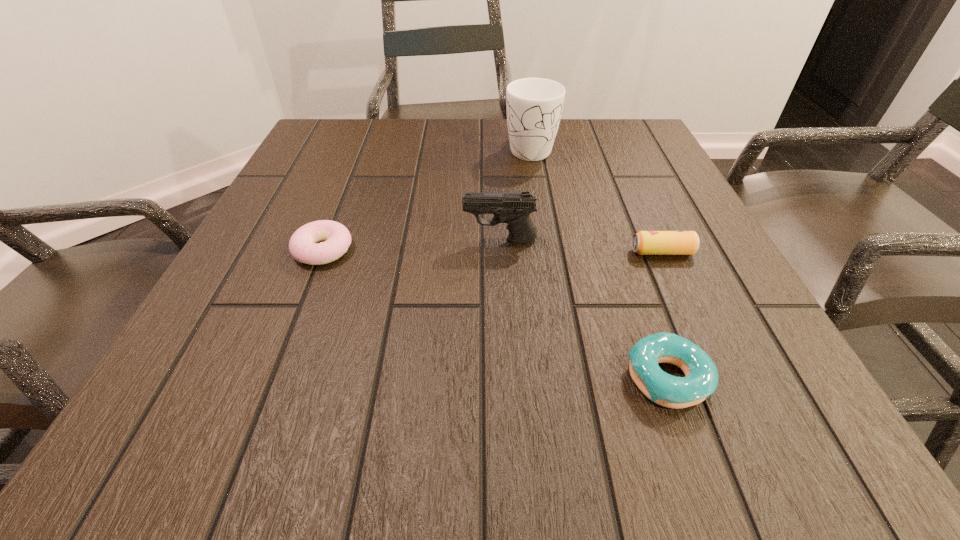
At what (x,y) coordinates should I click in order to perform the action: click on the tallest object. Please return your answer as a coordinate pair (x, y). Image resolution: width=960 pixels, height=540 pixels. Looking at the image, I should click on pos(534,106).

This screenshot has height=540, width=960. What are the coordinates of `mug` in the screenshot? It's located at (534, 106).

The height and width of the screenshot is (540, 960). I want to click on pistol, so click(514, 209).

Identify the location of beer can. (644, 242).

At what (x,y) coordinates should I click in order to perform the action: click on the nearer doughnut. Please return your answer as a coordinate pair (x, y). This screenshot has height=540, width=960. Looking at the image, I should click on (701, 380).

Locate an element on the screen. The height and width of the screenshot is (540, 960). the right doughnut is located at coordinates (701, 380).

This screenshot has width=960, height=540. What are the coordinates of `the leftmost object` in the screenshot? It's located at (337, 239).

Identify the location of the farther doughnut. The image size is (960, 540). 337,239.

This screenshot has width=960, height=540. What are the coordinates of `vacant point located on the side of the farthest object with the handle` in the screenshot? It's located at (536, 182).

I want to click on free space located 0.390m at the barrel of the second tallest object, so (253, 240).